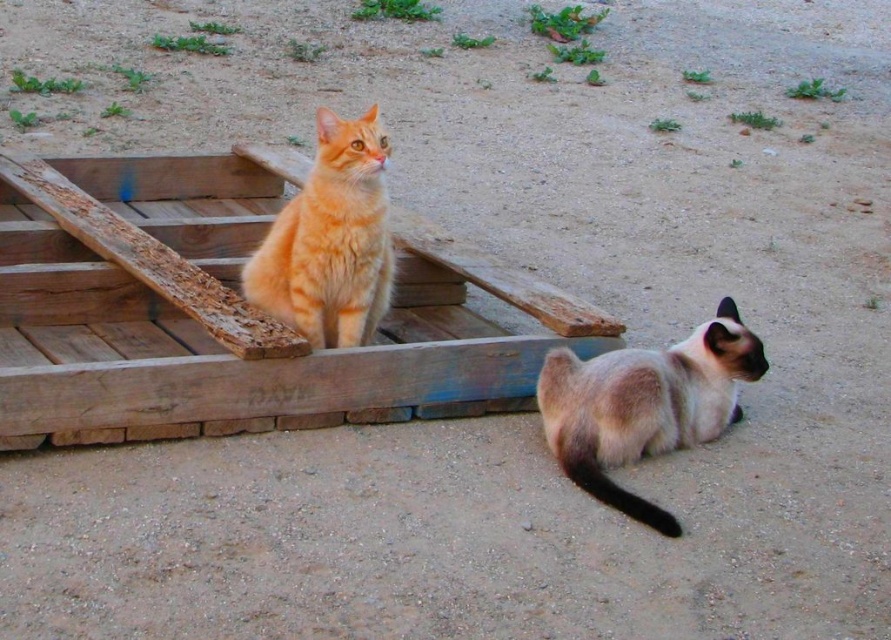
You are standing in the garden and see the silky fur cat at lower right and the orange fur cat at upper left. Which cat is positioned more to the right side of the garden?

The silky fur cat at lower right is positioned more to the right side of the garden than the orange fur cat at upper left.

You are a photographer trying to capture both cats in a single frame. Since the silky fur cat at lower right and the orange fur cat at upper left are positioned differently, which cat will appear closer to the camera in your photo?

The silky fur cat at lower right will appear closer to the camera because it is in front of the orange fur cat at upper left.